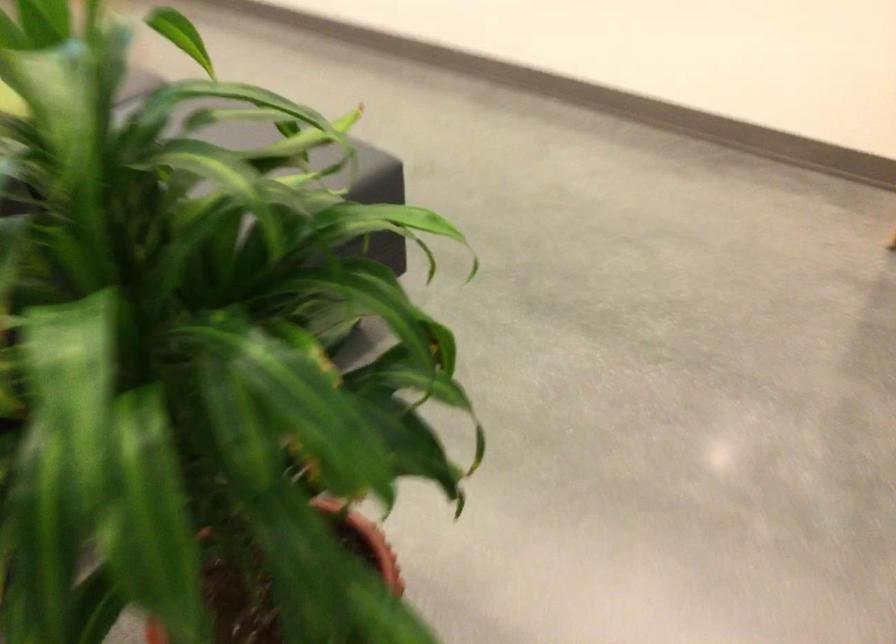
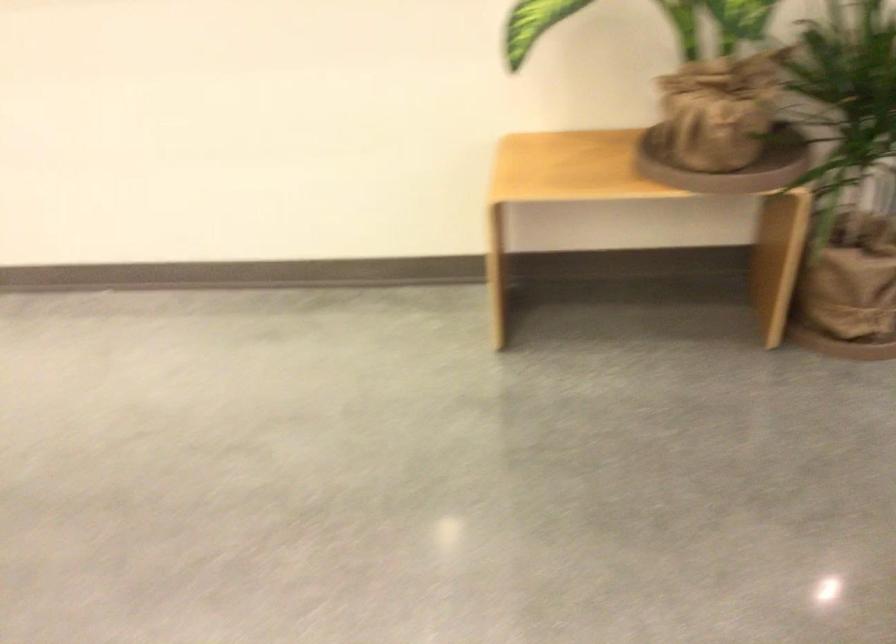
Question: Based on the continuous images, in which direction is the camera rotating? Reply with the corresponding letter.

Choices:
 (A) Left
 (B) Right
 (C) Up
 (D) Down

Answer: (B)